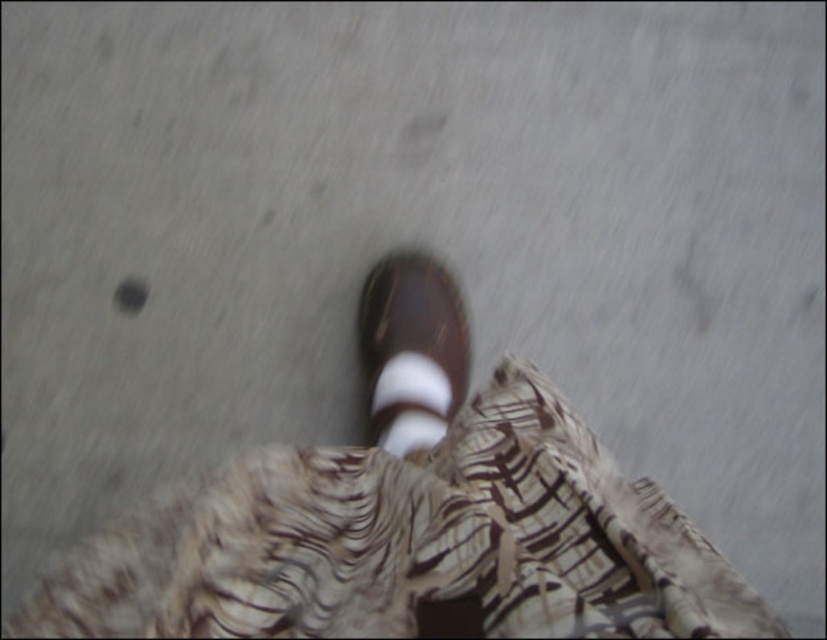
Question: Observing the image, what is the correct spatial positioning of brown leather shoe at center in reference to white striped sock at center?

Choices:
 (A) below
 (B) above

Answer: (B)

Question: Does brown leather shoe at center appear on the left side of white striped sock at center?

Choices:
 (A) yes
 (B) no

Answer: (B)

Question: Can you confirm if brown leather shoe at center is positioned below white striped sock at center?

Choices:
 (A) no
 (B) yes

Answer: (A)

Question: Among these objects, which one is farthest from the camera?

Choices:
 (A) brown leather shoe at center
 (B) white striped sock at center

Answer: (A)